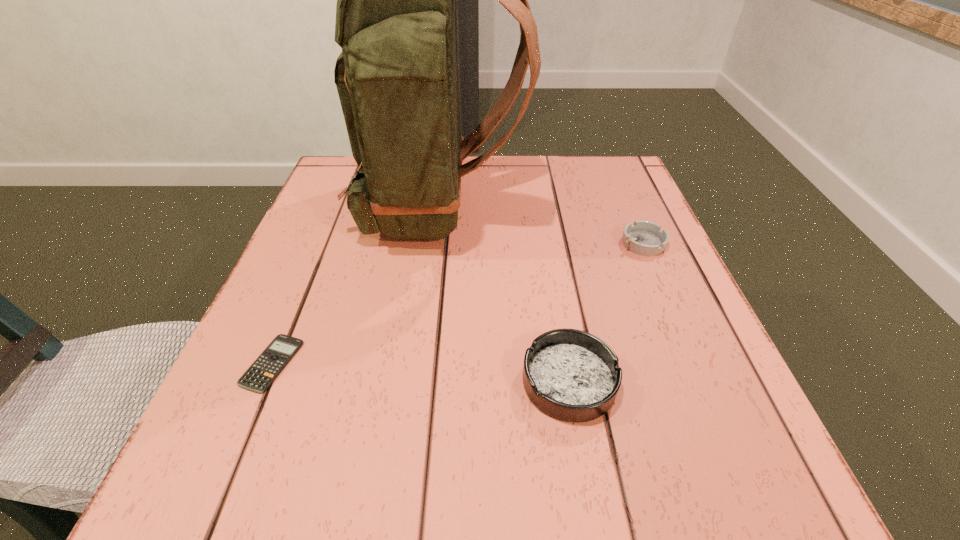
You are a GUI agent. You are given a task and a screenshot of the screen. Output one action in this format:
    pyautogui.click(x=<x>, y=<y>)
    Task: Click on the backpack
    The width and height of the screenshot is (960, 540).
    Given the screenshot: What is the action you would take?
    pyautogui.click(x=398, y=76)

The height and width of the screenshot is (540, 960). I want to click on the nearer ashtray, so click(x=571, y=375).

At what (x,y) coordinates should I click in order to perform the action: click on the left ashtray. Please return your answer as a coordinate pair (x, y). The height and width of the screenshot is (540, 960). Looking at the image, I should click on (571, 375).

This screenshot has width=960, height=540. In order to click on the shorter ashtray in this screenshot , I will do `click(645, 238)`.

The image size is (960, 540). In order to click on the rightmost object in this screenshot , I will do (645, 238).

This screenshot has width=960, height=540. What are the coordinates of `the leftmost object` in the screenshot? It's located at (260, 375).

Image resolution: width=960 pixels, height=540 pixels. In order to click on calculator in this screenshot , I will do `click(260, 375)`.

Where is `vacant space located on the back of the backpack`? vacant space located on the back of the backpack is located at coordinates (578, 208).

This screenshot has width=960, height=540. Find the location of `vacant region located on the left of the left ashtray`. vacant region located on the left of the left ashtray is located at coordinates (335, 381).

This screenshot has height=540, width=960. I want to click on free spot located 0.230m on the front of the second shortest object, so click(x=688, y=350).